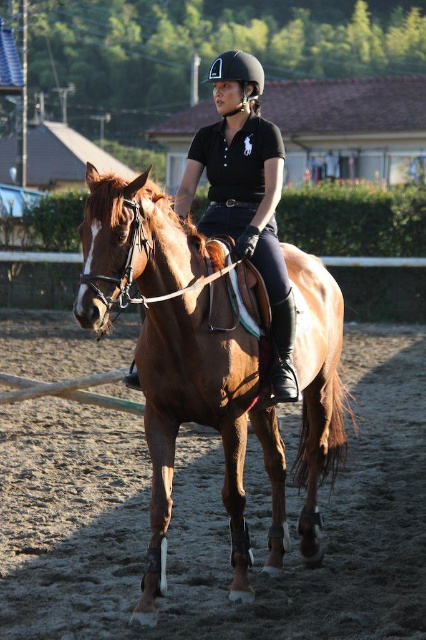
You are a horse trainer who needs to check the distance between the brown glossy horse at center and the black matte helmet at center. Can you confirm if the distance is more than 6 feet?

The distance between the brown glossy horse at center and the black matte helmet at center is 6.24 feet, so yes, the distance is more than 6 feet.

You are an equestrian instructor observing a rider and their horse in an arena. You notice the brown glossy horse at center and the black matte helmet at center. Which object takes up more visual space in the image?

The black matte helmet at center occupies more visual space than the brown glossy horse at center, as the description states that the horse occupies less space than the helmet.

You are a photographer positioned at the back of the arena. You want to take a photo of the black matte helmet at center without the brown glossy horse at center blocking it. Is this possible given their positions?

The brown glossy horse at center is in front of the black matte helmet at center, so it is blocking the helmet. Therefore, it is not possible to take a photo of the black matte helmet at center without the brown glossy horse at center blocking it from your current position at the back of the arena.